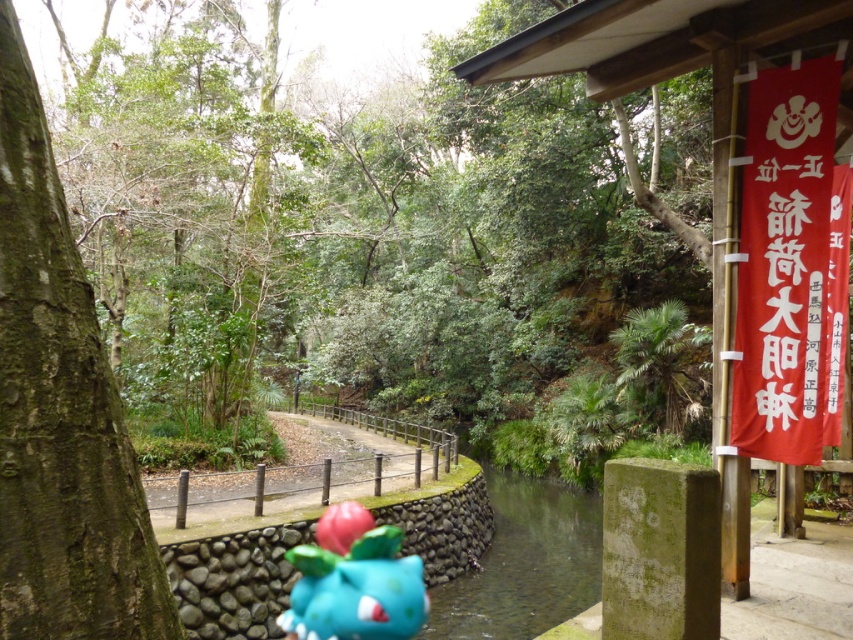
Where is `rough bark tree at left`? This screenshot has height=640, width=853. rough bark tree at left is located at coordinates (61, 410).

The image size is (853, 640). What do you see at coordinates (61, 410) in the screenshot?
I see `rough bark tree at left` at bounding box center [61, 410].

Locate an element on the screen. The height and width of the screenshot is (640, 853). rough bark tree at left is located at coordinates [x=61, y=410].